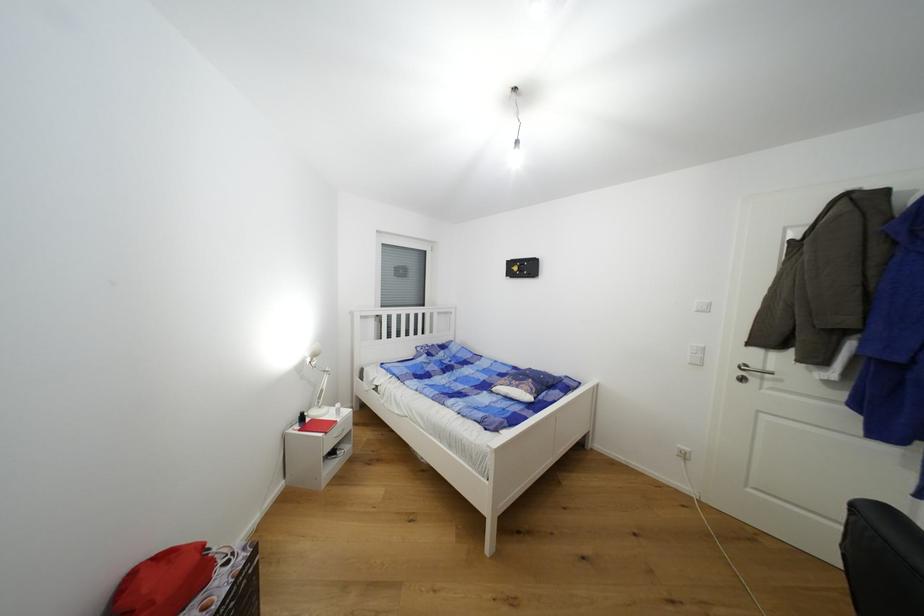
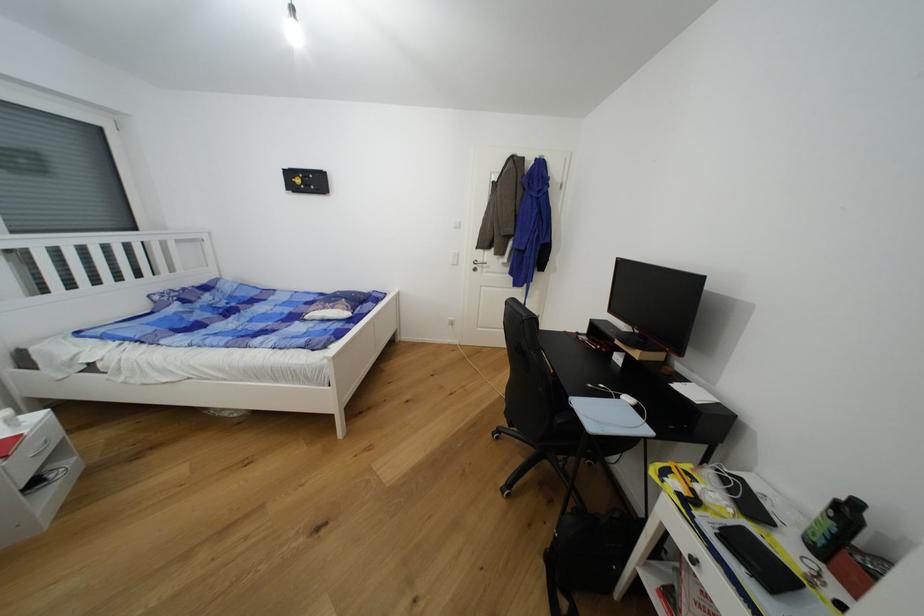
Find the pixel in the second image that matches pixel 523 387 in the first image.

(337, 310)